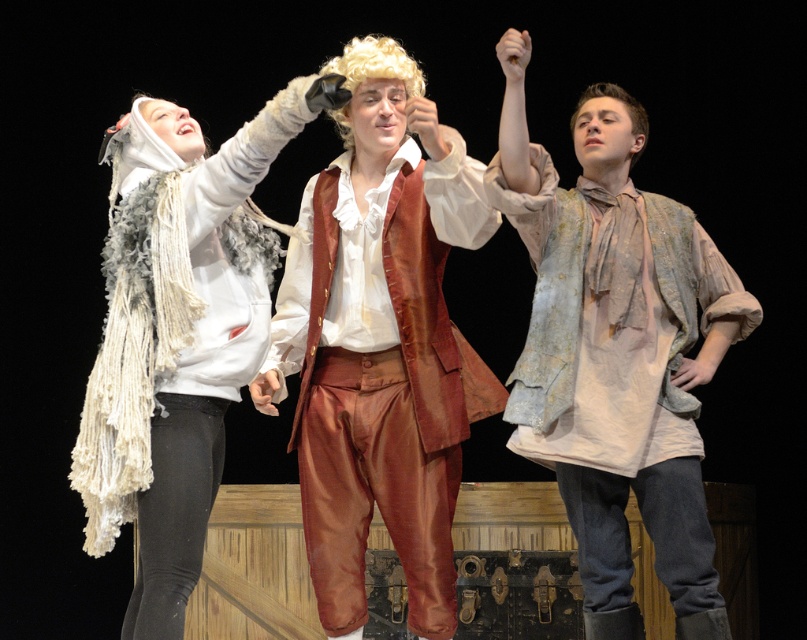
Does satin brown vest at center have a greater height compared to white fluffy scarf at upper left?

Yes.

Does satin brown vest at center appear on the left side of white fluffy scarf at upper left?

Incorrect, satin brown vest at center is not on the left side of white fluffy scarf at upper left.

Is point (362, 230) more distant than point (103, 525)?

That is True.

The image size is (807, 640). I want to click on satin brown vest at center, so click(381, 342).

Is distressed white shirt at center smaller than white fluffy scarf at upper left?

Actually, distressed white shirt at center might be larger than white fluffy scarf at upper left.

Between distressed white shirt at center and white fluffy scarf at upper left, which one has less height?

white fluffy scarf at upper left is shorter.

Between point (559, 284) and point (211, 200), which one is positioned behind?

Point (559, 284)

Where is `distressed white shirt at center`? The width and height of the screenshot is (807, 640). distressed white shirt at center is located at coordinates (617, 352).

Who is positioned more to the left, satin brown vest at center or distressed white shirt at center?

satin brown vest at center is more to the left.

Is point (371, 241) positioned in front of point (575, 220)?

Yes.

Who is more forward, (383,192) or (626,483)?

Point (383,192)

Locate an element on the screen. The image size is (807, 640). satin brown vest at center is located at coordinates (381, 342).